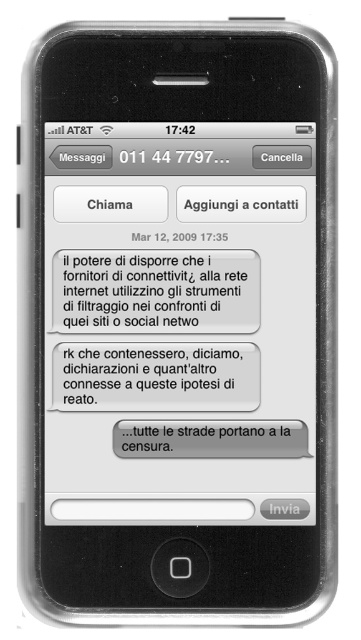
At what (x,y) coordinates should I click in order to perform the action: click on white paper text message at center. Please return your answer as a coordinate pair (x, y). Looking at the image, I should click on (155, 291).

Is white paper text message at center closer to the viewer compared to white paper text at center?

No, it is behind white paper text at center.

Between point (188, 320) and point (157, 403), which one is positioned in front?

Point (157, 403) is in front.

I want to click on white paper text message at center, so click(x=155, y=291).

How much distance is there between white paper text message at center and gray matte text message at center?

white paper text message at center and gray matte text message at center are 15.92 centimeters apart.

This screenshot has height=640, width=361. What are the coordinates of `white paper text message at center` in the screenshot? It's located at (155, 291).

Who is taller, white paper text at center or gray matte text message at center?

white paper text at center is taller.

Is white paper text at center further to camera compared to gray matte text message at center?

That is True.

Between point (132, 352) and point (153, 433), which one is positioned behind?

The point (132, 352) is behind.

Identify the location of white paper text at center. (154, 376).